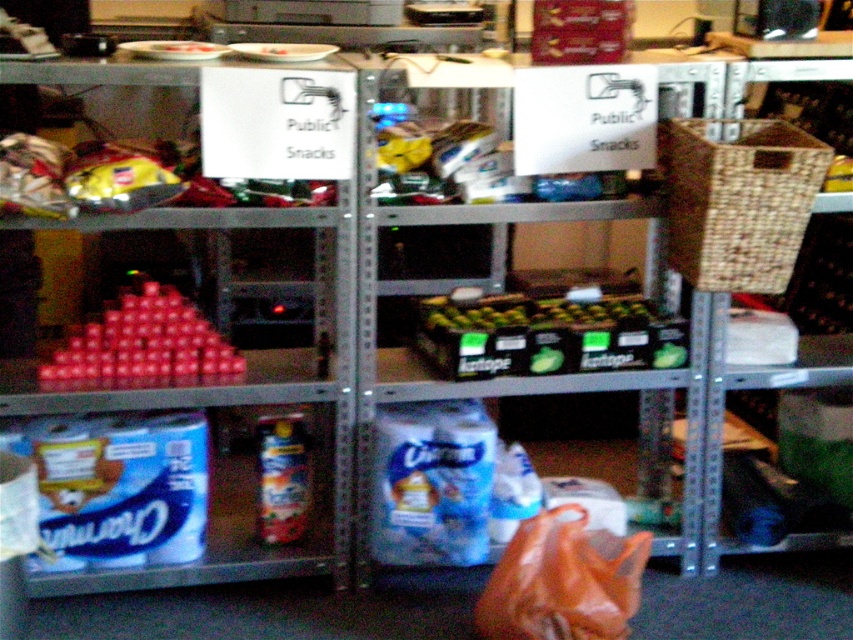
Question: Is blue cardboard charmin at lower left positioned in front of matte plastic cups at left?

Choices:
 (A) no
 (B) yes

Answer: (B)

Question: Which is nearer to the blue cardboard charmin at lower left?

Choices:
 (A) matte plastic cups at left
 (B) orange plastic bag at lower center

Answer: (A)

Question: From the image, what is the correct spatial relationship of orange plastic bag at lower center in relation to blue cardboard charmin at lower left?

Choices:
 (A) above
 (B) below

Answer: (B)

Question: Based on their relative distances, which object is nearer to the orange plastic bag at lower center?

Choices:
 (A) blue cardboard charmin at lower left
 (B) matte plastic cups at left

Answer: (A)

Question: Among these objects, which one is nearest to the camera?

Choices:
 (A) matte plastic cups at left
 (B) blue cardboard charmin at lower left

Answer: (B)

Question: Does orange plastic bag at lower center appear over blue cardboard charmin at lower left?

Choices:
 (A) no
 (B) yes

Answer: (A)